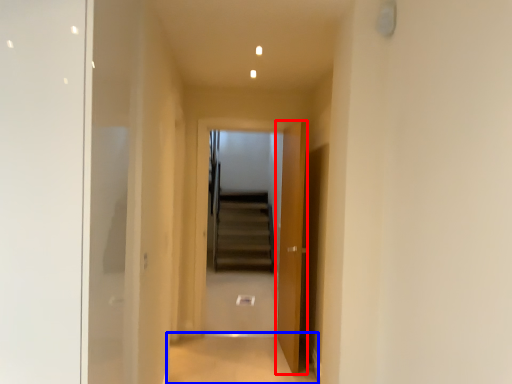
Question: Which point is further to the camera, door (highlighted by a red box) or path (highlighted by a blue box)?

Choices:
 (A) door
 (B) path

Answer: (A)